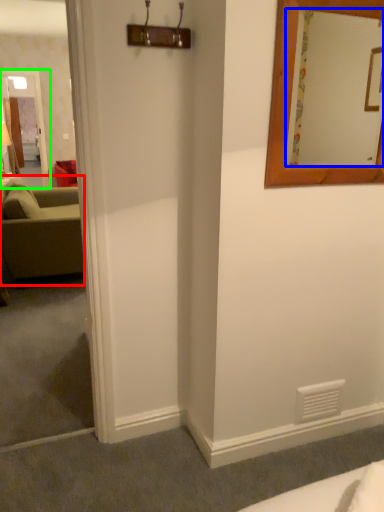
Question: Considering the real-world distances, which object is farthest from studio couch (highlighted by a red box)? mirror (highlighted by a blue box) or glass door (highlighted by a green box)?

Choices:
 (A) mirror
 (B) glass door

Answer: (B)